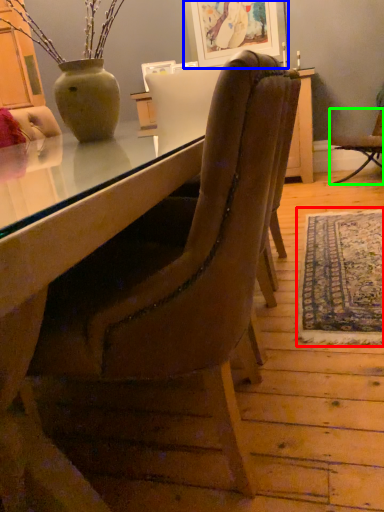
Question: Which object is positioned closest to mat (highlighted by a red box)? Select from picture frame (highlighted by a blue box) and chair (highlighted by a green box).

Choices:
 (A) picture frame
 (B) chair

Answer: (B)